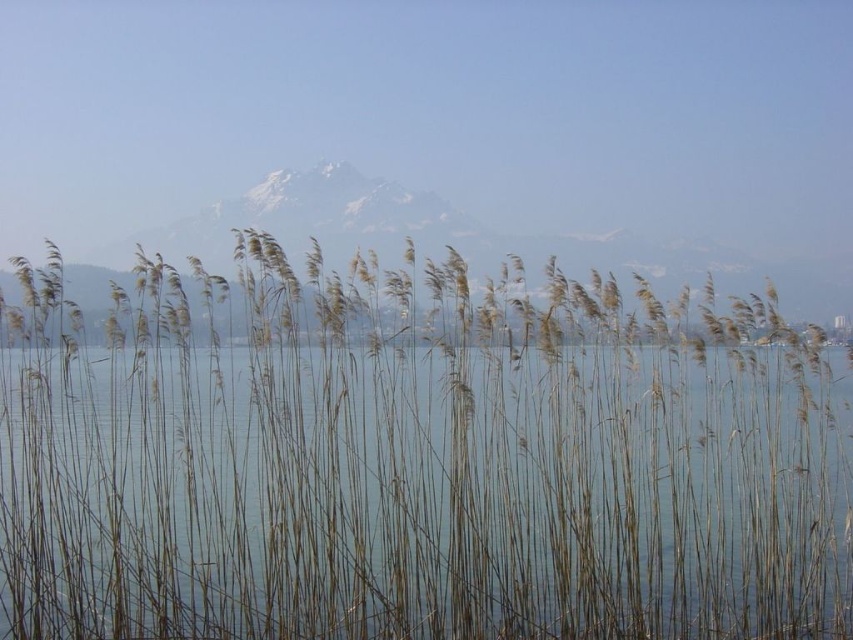
Question: Which point appears closest to the camera in this image?

Choices:
 (A) (717, 248)
 (B) (224, 445)

Answer: (B)

Question: Does dry reeds at center have a smaller size compared to snowy rock mountain at center?

Choices:
 (A) no
 (B) yes

Answer: (B)

Question: Is dry reeds at center positioned in front of snowy rock mountain at center?

Choices:
 (A) no
 (B) yes

Answer: (B)

Question: Which point is closer to the camera?

Choices:
 (A) (337, 259)
 (B) (175, 342)

Answer: (B)

Question: Is dry reeds at center positioned before snowy rock mountain at center?

Choices:
 (A) no
 (B) yes

Answer: (B)

Question: Which object is farther from the camera taking this photo?

Choices:
 (A) snowy rock mountain at center
 (B) dry reeds at center

Answer: (A)